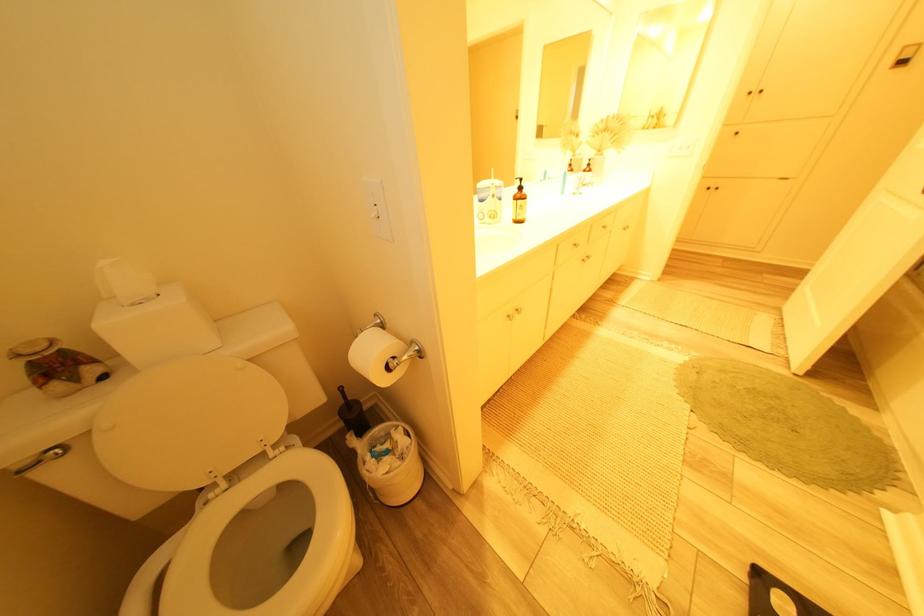
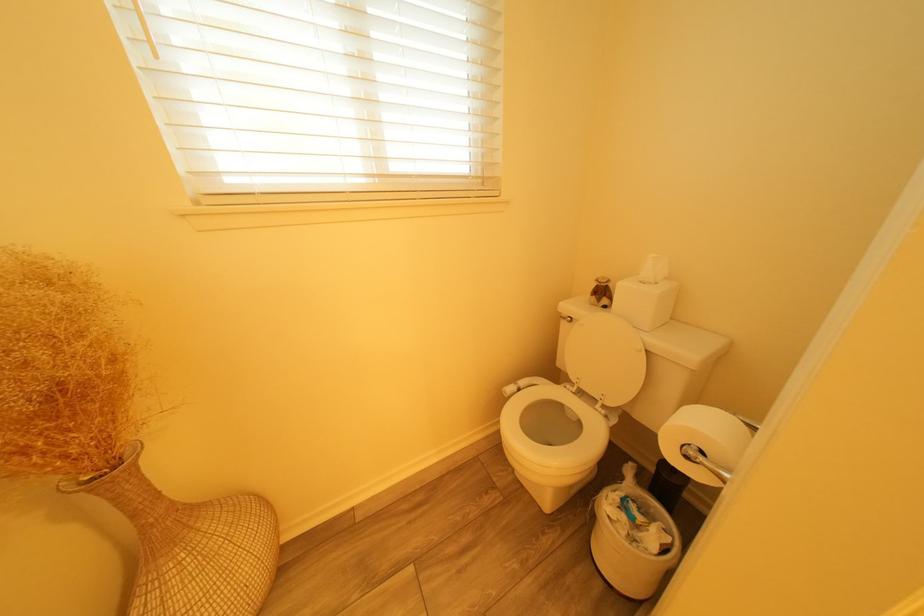
Find the pixel in the second image that matches [397,475] in the first image.

(619, 519)